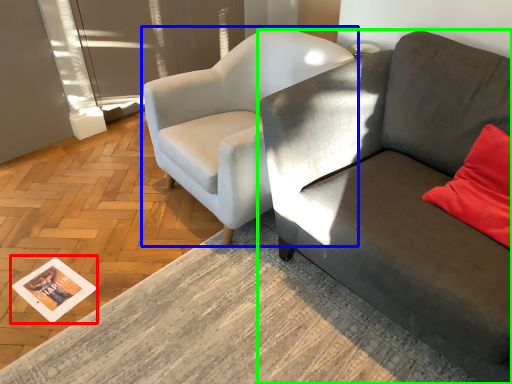
Question: Which object is the closest to the magazine (highlighted by a red box)? Choose among these: chair (highlighted by a blue box) or studio couch (highlighted by a green box).

Choices:
 (A) chair
 (B) studio couch

Answer: (A)